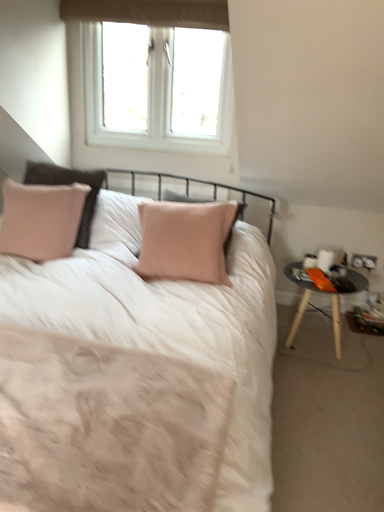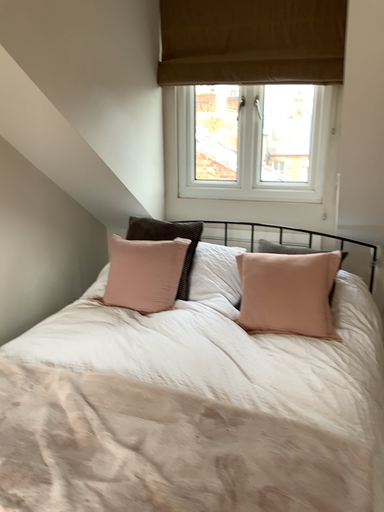
Question: How did the camera likely rotate when shooting the video?

Choices:
 (A) rotated left
 (B) rotated right

Answer: (A)